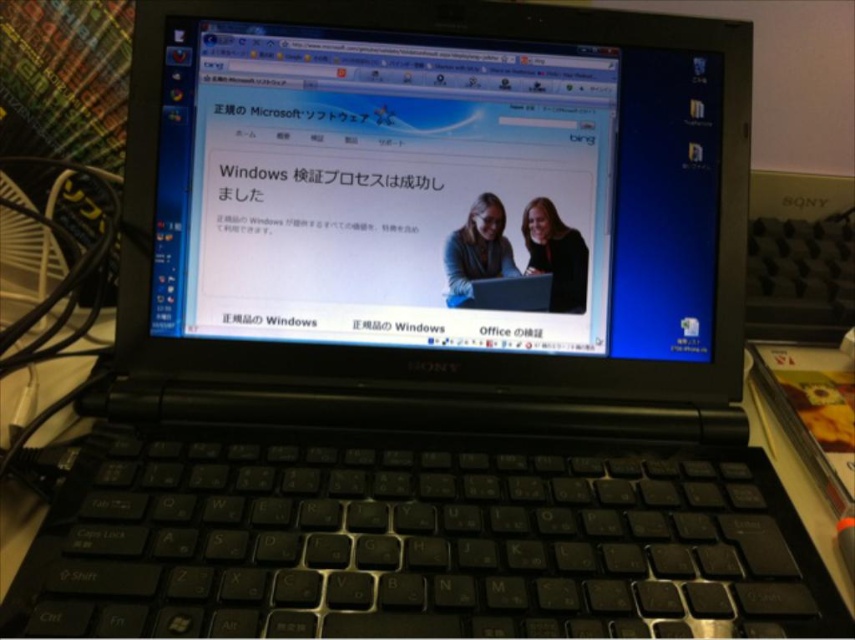
Consider the image. You are looking at the laptop screen showing a webpage about Windows activation. The screen has a point labeled as point (435, 189). Where on the laptop screen is this point located?

The point (435, 189) is located at the center of the matte black laptop at center.